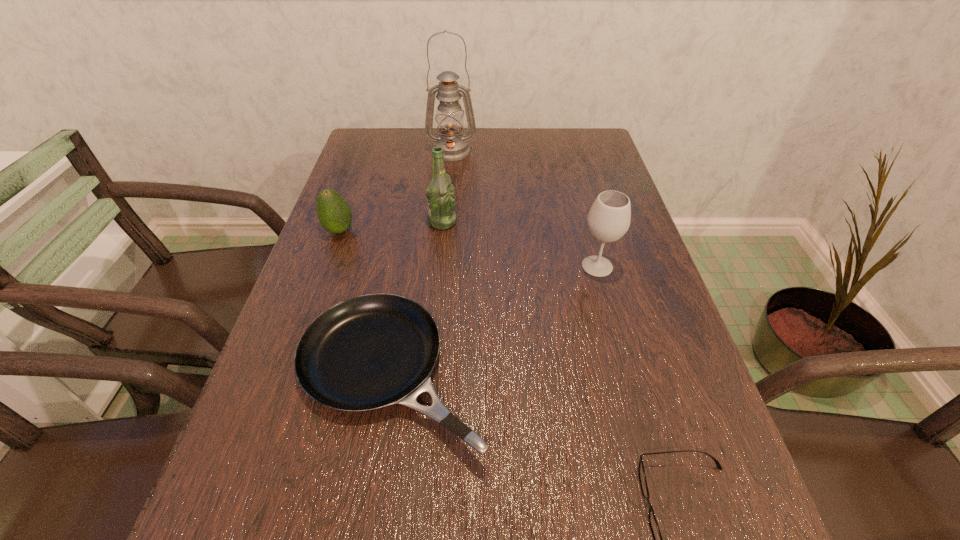
Where is `unoccupied area between the beer bottle and the third nearest object`? This screenshot has height=540, width=960. unoccupied area between the beer bottle and the third nearest object is located at coordinates (519, 244).

The width and height of the screenshot is (960, 540). Identify the location of blank region between the fourth tallest object and the oil lamp. (396, 192).

Identify which object is located as the nearest to the beer bottle. Please provide its 2D coordinates. Your answer should be formatted as a tuple, i.e. [(x, y)], where the tuple contains the x and y coordinates of a point satisfying the conditions above.

[(334, 214)]

Select which object is the third closest to the farthest object. Please provide its 2D coordinates. Your answer should be formatted as a tuple, i.e. [(x, y)], where the tuple contains the x and y coordinates of a point satisfying the conditions above.

[(609, 218)]